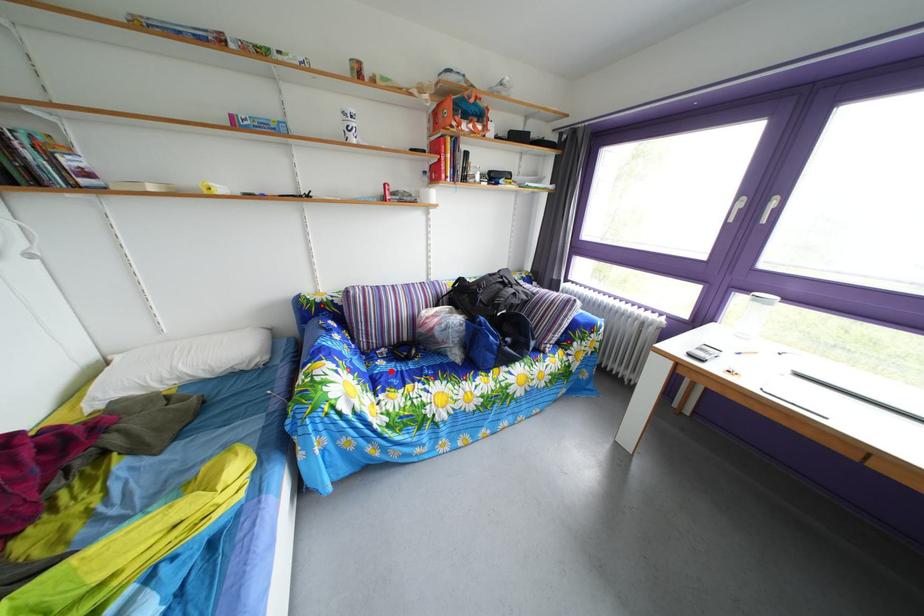
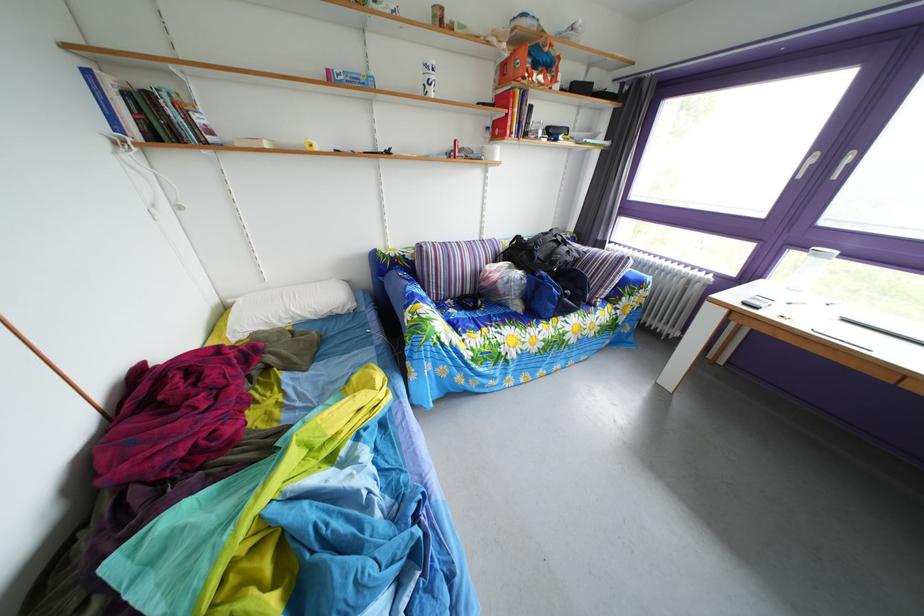
The point at the highlighted location is marked in the first image. Where is the corresponding point in the second image?

(463, 320)